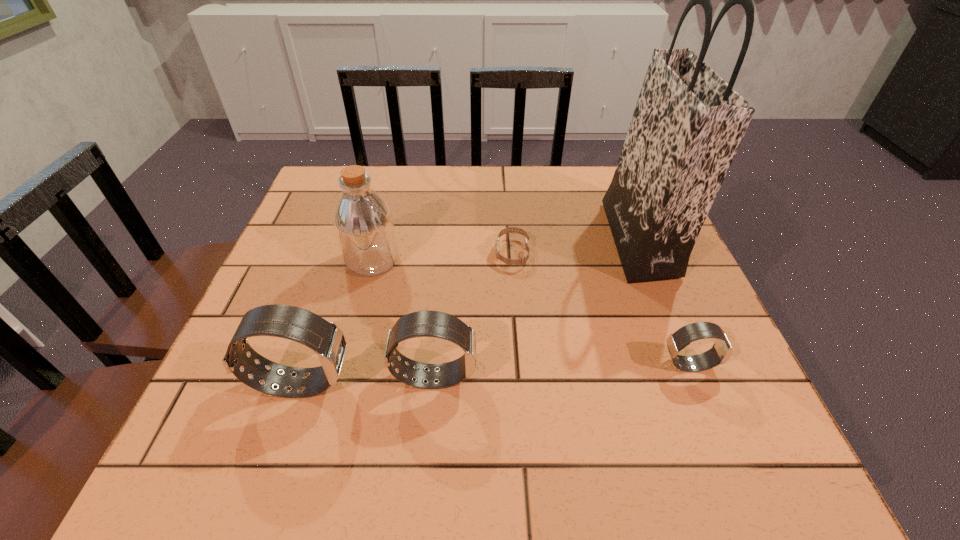
Image resolution: width=960 pixels, height=540 pixels. I want to click on the third closest object to the bottle, so click(325, 338).

Locate an element on the screen. The height and width of the screenshot is (540, 960). watch identified as the closest to the leftmost watch is located at coordinates (436, 324).

Image resolution: width=960 pixels, height=540 pixels. I want to click on the second closest watch to the bottle, so click(x=523, y=260).